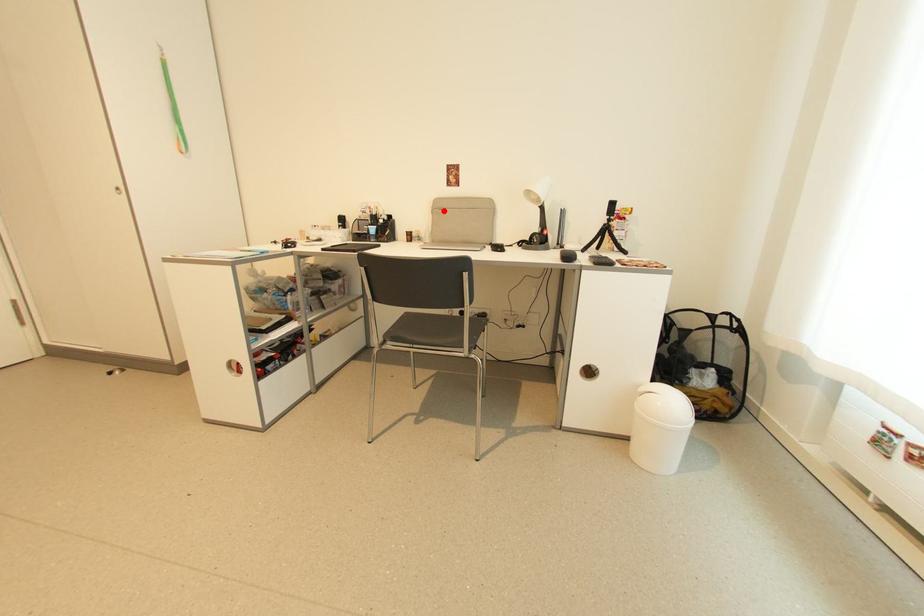
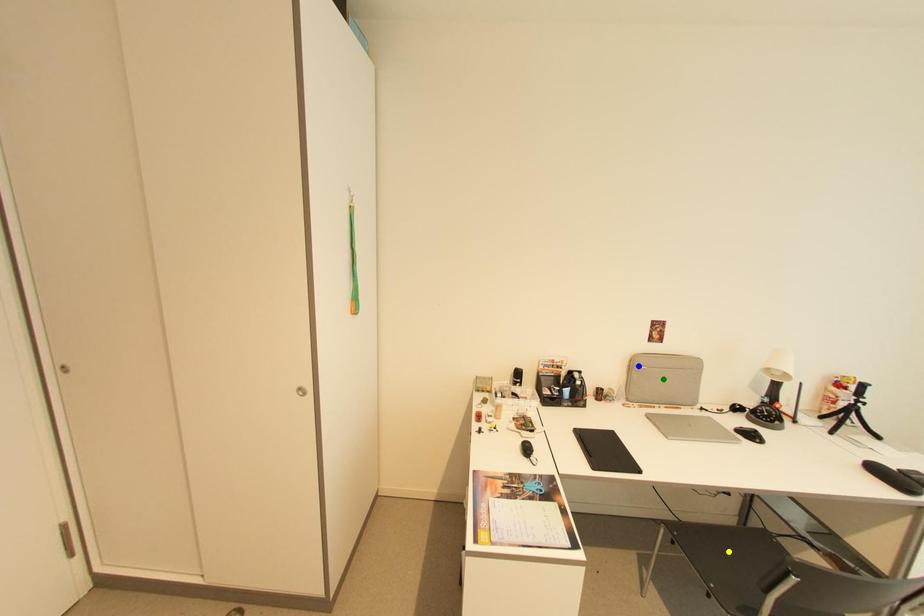
Question: I am providing you with two images of the same scene from different viewpoints. A red point is marked on the first image. You are given multiple points on the second image. Which point in image 2 represents the same 3d spot as the red point in image 1?

Choices:
 (A) blue point
 (B) green point
 (C) yellow point

Answer: (A)